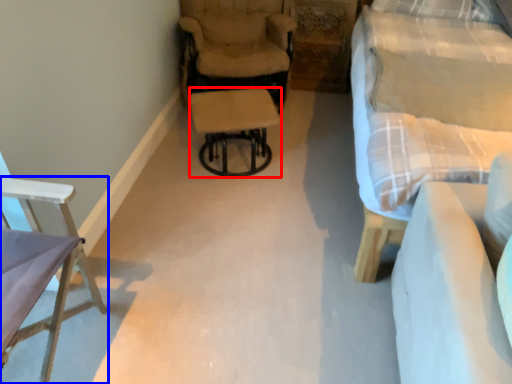
Question: Which object is further to the camera taking this photo, stool (highlighted by a red box) or chair (highlighted by a blue box)?

Choices:
 (A) stool
 (B) chair

Answer: (A)